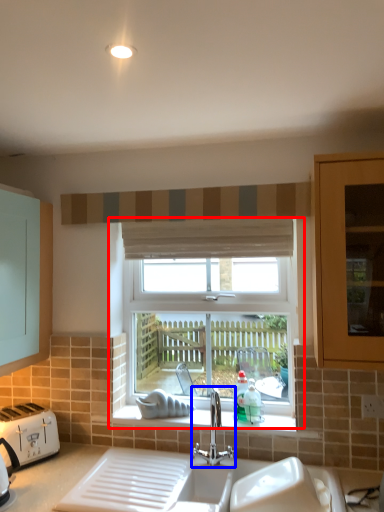
Question: Among these objects, which one is farthest to the camera, window (highlighted by a red box) or tap (highlighted by a blue box)?

Choices:
 (A) window
 (B) tap

Answer: (A)